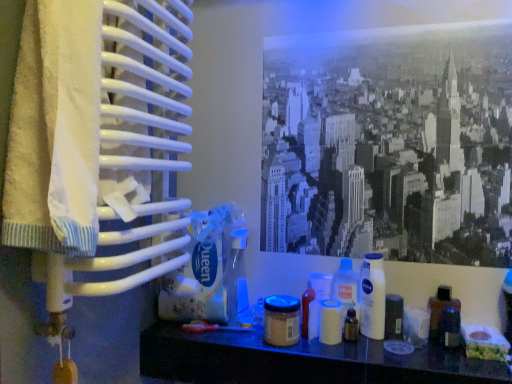
You are a GUI agent. You are given a task and a screenshot of the screen. Output one action in this format:
    pyautogui.click(x=<x>, y=<y>)
    Task: Click on the free location to the left of translucent plastic bottle at lower right, the first bottle when ordered from right to left
    
    Given the screenshot: What is the action you would take?
    (381, 354)